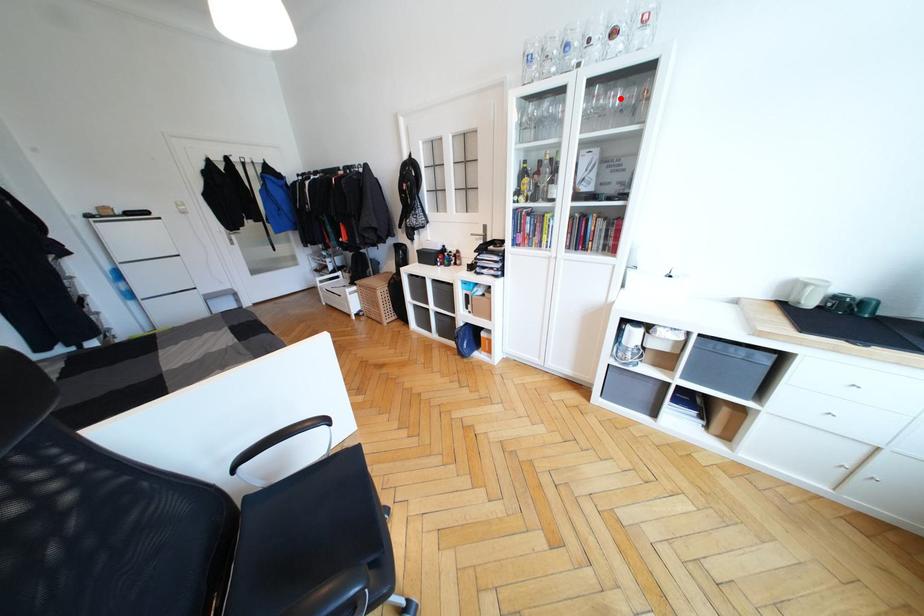
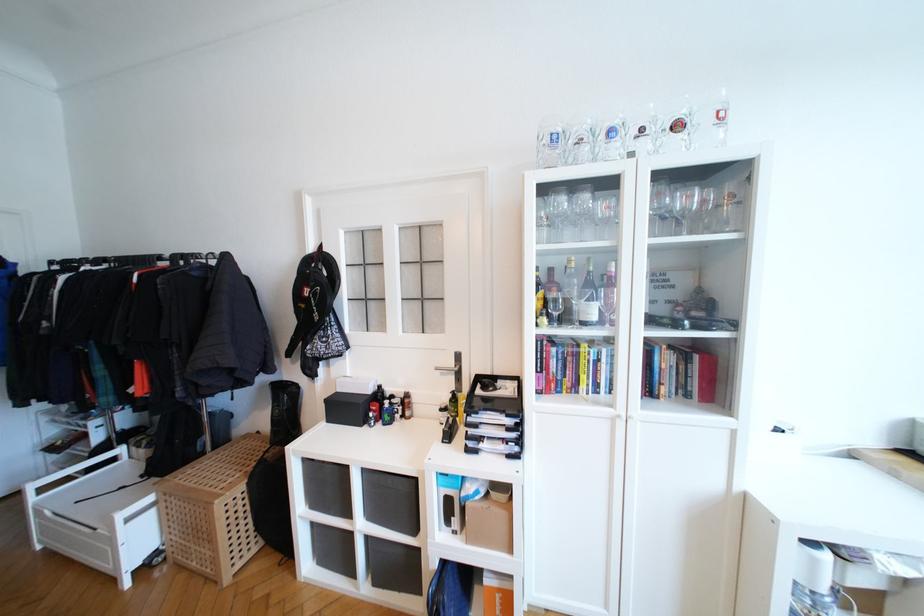
Locate, in the second image, the point that corresponds to the highlighted location in the first image.

(691, 200)